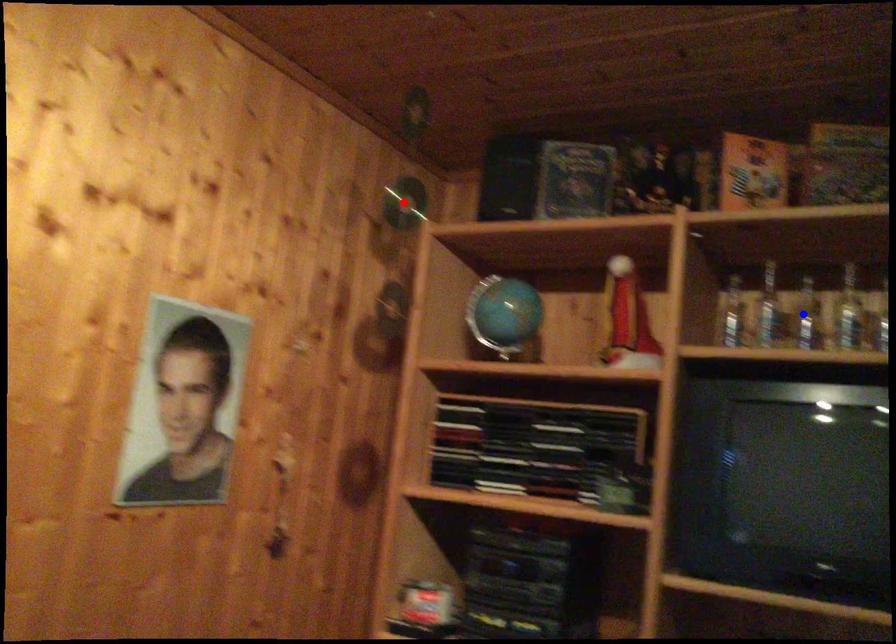
Question: Which of the two points in the image is closer to the camera?

Choices:
 (A) Blue point is closer.
 (B) Red point is closer.

Answer: (B)